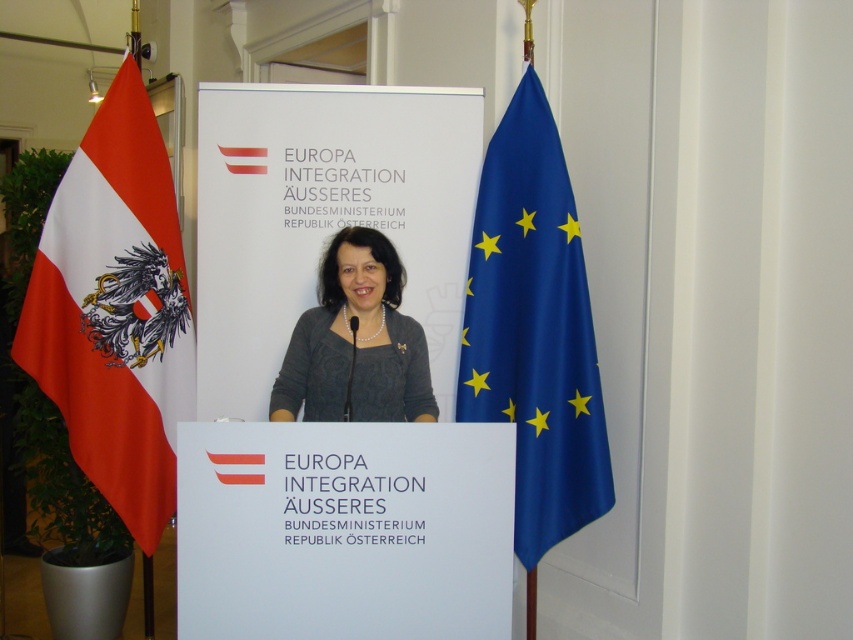
You are attending the press conference and want to describe the arrangement of the flags and the speaker. Which object is positioned to the right of the other between the blue satin flag at right and the matte gray sweater at center?

The blue satin flag at right is positioned to the right of the matte gray sweater at center.